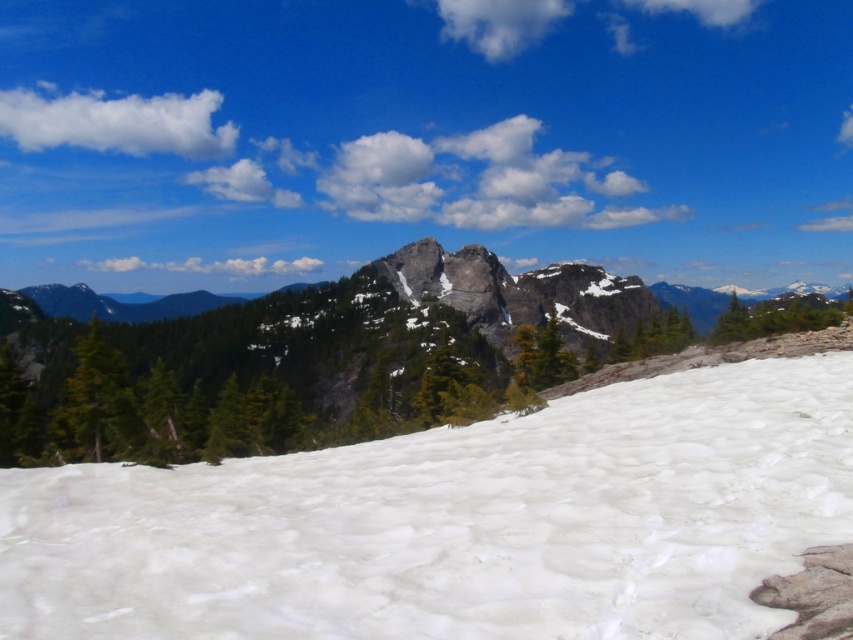
You are a hiker planning to cross the white snow at center and the rocky mountain at center. Based on the scene, which object should you approach first if you want to reach the other side?

The white snow at center is positioned on the right side of rocky mountain at center, so you should approach the rocky mountain at center first to reach the other side.

You are a hiker planning to cross the white snow at center and the rocky mountain at center. Based on their sizes, which one would require more careful navigation?

The rocky mountain at center requires more careful navigation since it is larger than the white snow at center.